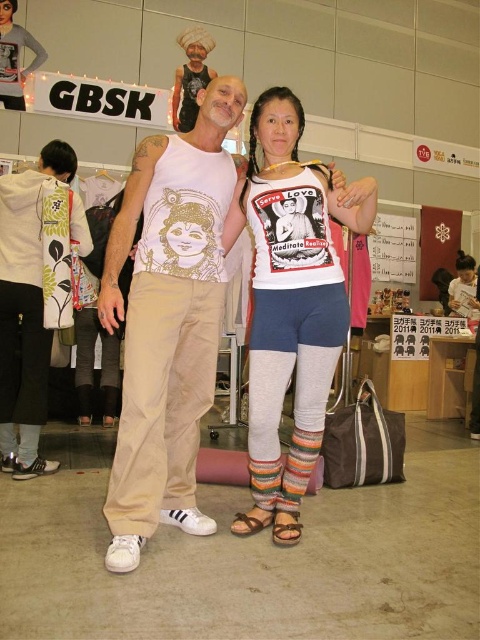
Question: Can you confirm if beige cotton tank top at center is bigger than striped wool socks at lower center?

Choices:
 (A) no
 (B) yes

Answer: (B)

Question: Considering the real-world distances, which object is farthest from the white cotton t-shirt at center?

Choices:
 (A) striped wool socks at lower center
 (B) white floral-patterned hoodie at lower left
 (C) beige cotton tank top at center

Answer: (B)

Question: Which object appears closest to the camera in this image?

Choices:
 (A) white floral-patterned hoodie at lower left
 (B) beige cotton tank top at center
 (C) white cotton t-shirt at center
 (D) striped wool socks at lower center

Answer: (B)

Question: Can you confirm if beige cotton tank top at center is positioned above white cotton t-shirt at center?

Choices:
 (A) yes
 (B) no

Answer: (A)

Question: Which point is farther to the camera?

Choices:
 (A) beige cotton tank top at center
 (B) white cotton t-shirt at center

Answer: (B)

Question: Is beige cotton tank top at center further to the viewer compared to striped wool socks at lower center?

Choices:
 (A) no
 (B) yes

Answer: (A)